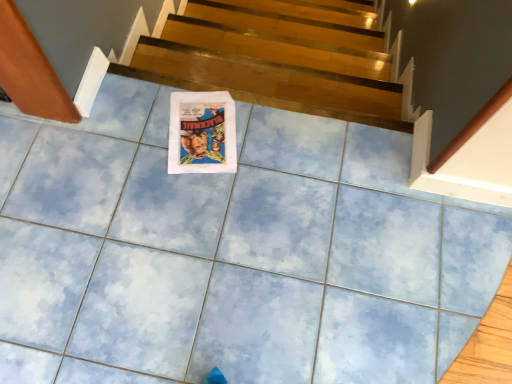
Where is `vacant area that is in front of matte paper poster at center`? This screenshot has height=384, width=512. vacant area that is in front of matte paper poster at center is located at coordinates [190, 203].